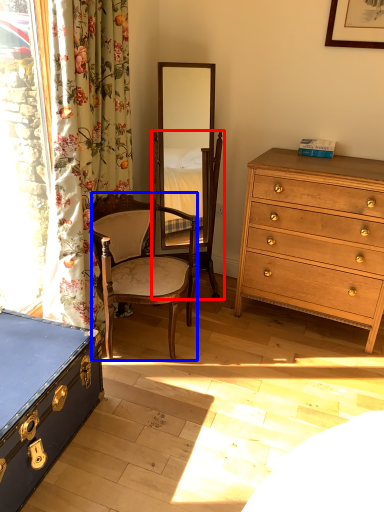
Question: Which object is further to the camera taking this photo, swivel chair (highlighted by a red box) or chair (highlighted by a blue box)?

Choices:
 (A) swivel chair
 (B) chair

Answer: (A)